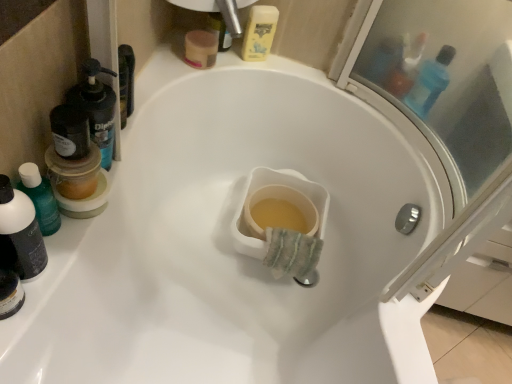
Question: Is blue translucent bottle at upper right, the 2th mouthwash when ordered from top to bottom, wider or thinner than translucent plastic mouthwash at left, the fourth mouthwash viewed from the right?

Choices:
 (A) wide
 (B) thin

Answer: (A)

Question: Considering the positions of blue translucent bottle at upper right, the 3th mouthwash positioned from the front, and translucent plastic mouthwash at left, the first mouthwash positioned from the front, in the image, is blue translucent bottle at upper right, the 3th mouthwash positioned from the front, taller or shorter than translucent plastic mouthwash at left, the first mouthwash positioned from the front,?

Choices:
 (A) tall
 (B) short

Answer: (B)

Question: Which is farther from the black plastic mouthwash at left, the 3th mouthwash when ordered from top to bottom?

Choices:
 (A) blue translucent bottle at upper right, which ranks as the 2th mouthwash in back-to-front order
 (B) yellow plastic mouthwash at upper center, the fourth mouthwash when ordered from bottom to top
 (C) translucent plastic mouthwash at left, the first mouthwash positioned from the front

Answer: (A)

Question: Which object is positioned farthest from the blue translucent bottle at upper right, the 3th mouthwash positioned from the front?

Choices:
 (A) translucent plastic mouthwash at left, which appears as the first mouthwash when viewed from the left
 (B) black plastic mouthwash at left, the second mouthwash ordered from the bottom
 (C) yellow plastic mouthwash at upper center, which is the fourth mouthwash in front-to-back order

Answer: (A)